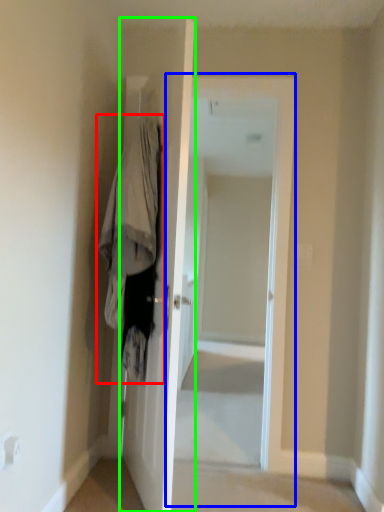
Question: Considering the real-world distances, which object is closest to clothing (highlighted by a red box)? screen door (highlighted by a blue box) or door (highlighted by a green box).

Choices:
 (A) screen door
 (B) door

Answer: (B)